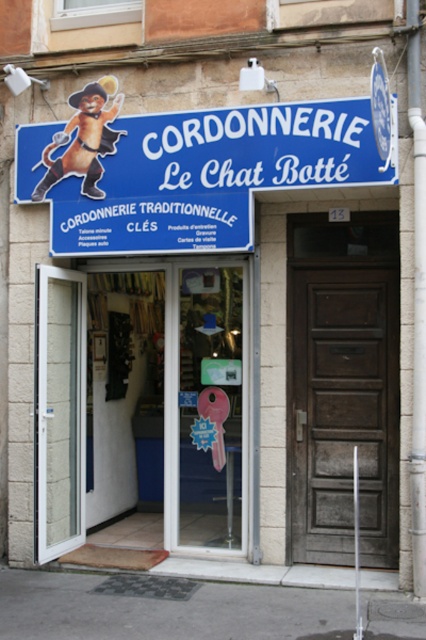
Question: Does dark wood door at center have a lesser width compared to white plastic door at left?

Choices:
 (A) yes
 (B) no

Answer: (B)

Question: Which object appears farthest from the camera in this image?

Choices:
 (A) white plastic door at left
 (B) dark wood door at center

Answer: (B)

Question: Does dark wood door at center appear on the right side of white plastic door at left?

Choices:
 (A) yes
 (B) no

Answer: (A)

Question: Does dark wood door at center appear on the right side of white plastic door at left?

Choices:
 (A) no
 (B) yes

Answer: (B)

Question: Which point is farther from the camera taking this photo?

Choices:
 (A) (66, 358)
 (B) (377, 557)

Answer: (A)

Question: Among these points, which one is nearest to the camera?

Choices:
 (A) coord(74,509)
 (B) coord(301,282)

Answer: (B)